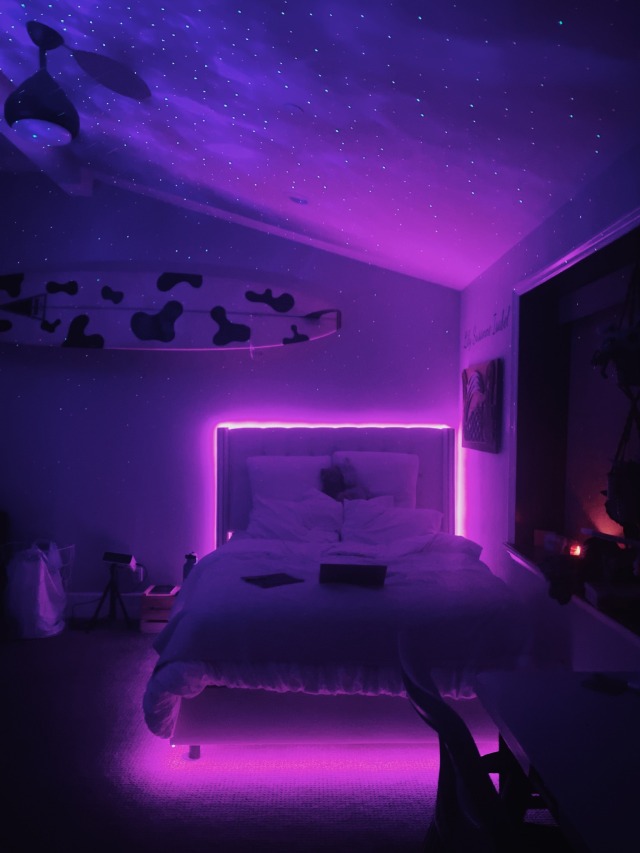
Identify the location of desk. The height and width of the screenshot is (853, 640). coord(598,753).